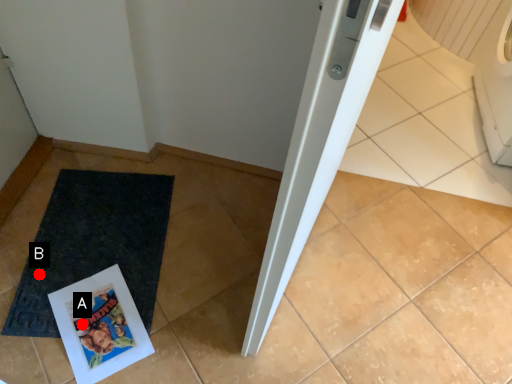
Question: Two points are circled on the image, labeled by A and B beside each circle. Among these points, which one is nearest to the camera?

Choices:
 (A) A is closer
 (B) B is closer

Answer: (A)